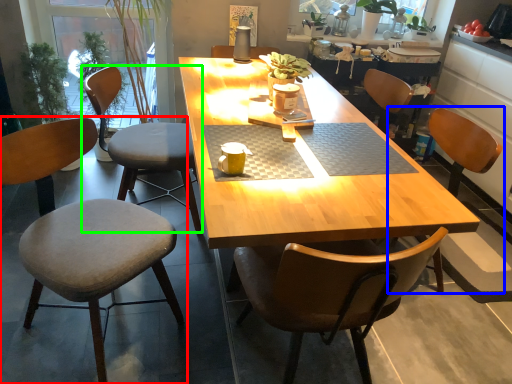
Question: Considering the real-world distances, which object is closest to chair (highlighted by a red box)? chair (highlighted by a blue box) or chair (highlighted by a green box).

Choices:
 (A) chair
 (B) chair

Answer: (B)